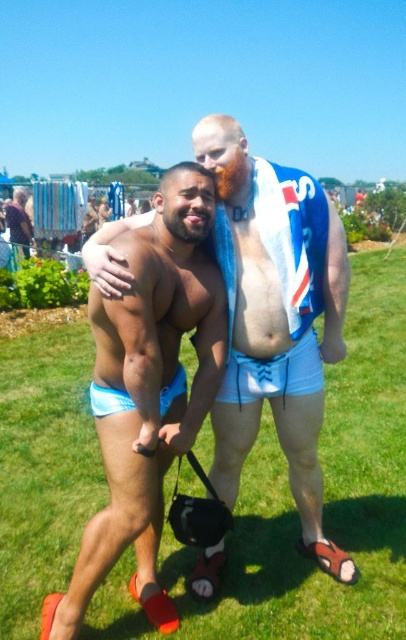
Question: Does green grass at center appear on the right side of white fabric shorts at center?

Choices:
 (A) no
 (B) yes

Answer: (B)

Question: Estimate the real-world distances between objects in this image. Which object is farther from the green grass at center?

Choices:
 (A) matte white shorts at center
 (B) white fabric shorts at center
 (C) blue fabric shorts at lower left

Answer: (C)

Question: Is matte white shorts at center below blue fabric shorts at center?

Choices:
 (A) no
 (B) yes

Answer: (A)

Question: Among these points, which one is farthest from the camera?

Choices:
 (A) (295, 371)
 (B) (149, 604)
 (C) (401, 618)

Answer: (A)

Question: Is blue fabric shorts at center closer to camera compared to white fabric shorts at center?

Choices:
 (A) yes
 (B) no

Answer: (A)

Question: Which point is closer to the camera?

Choices:
 (A) blue fabric shorts at center
 (B) green grass at center
 (C) blue fabric shorts at lower left

Answer: (A)